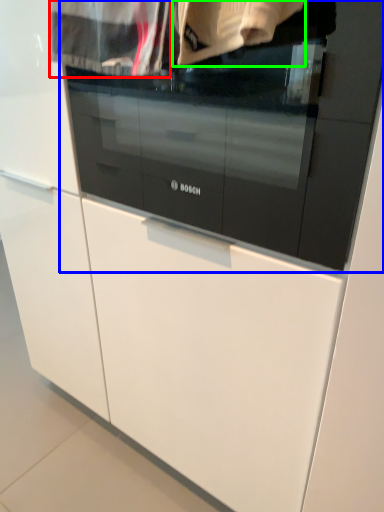
Question: Based on their relative distances, which object is nearer to clothing (highlighted by a red box)? Choose from oven (highlighted by a blue box) and clothing (highlighted by a green box).

Choices:
 (A) oven
 (B) clothing

Answer: (B)